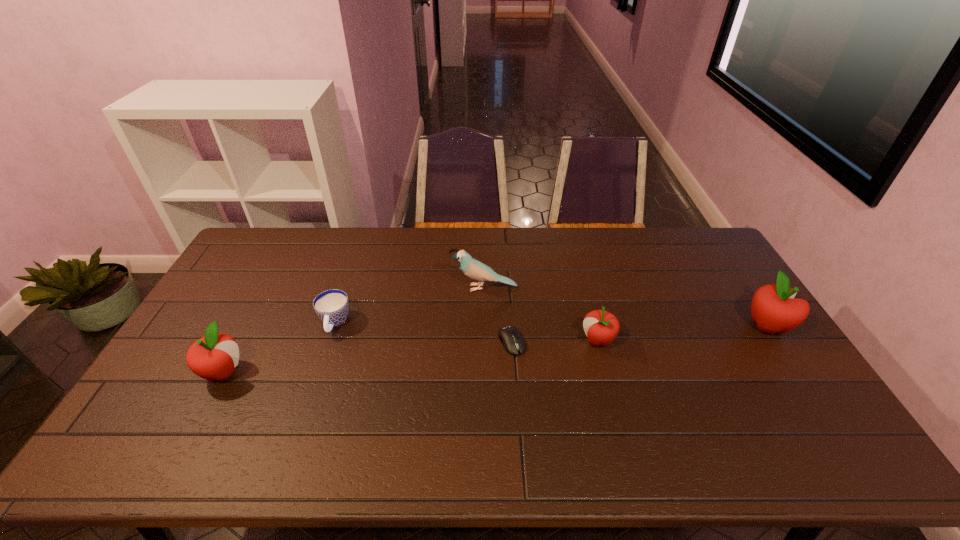
Find the location of `free space between the rightmost object and the bird`. free space between the rightmost object and the bird is located at coordinates (626, 307).

Find the location of a particular element. The height and width of the screenshot is (540, 960). vacant space that is in between the farthest object and the rightmost apple is located at coordinates (626, 307).

Locate an element on the screen. This screenshot has height=540, width=960. vacant space in between the second tallest apple and the shortest apple is located at coordinates (411, 356).

Locate an element on the screen. This screenshot has height=540, width=960. empty location between the nearest apple and the rightmost apple is located at coordinates (495, 349).

Find the location of `object that is the fourth closest to the fifth object from left to right`. object that is the fourth closest to the fifth object from left to right is located at coordinates (332, 306).

Identify which object is the third nearest to the leftmost object. Please provide its 2D coordinates. Your answer should be formatted as a tuple, i.e. [(x, y)], where the tuple contains the x and y coordinates of a point satisfying the conditions above.

[(510, 337)]

Choose which apple is the nearest neighbor to the bird. Please provide its 2D coordinates. Your answer should be formatted as a tuple, i.e. [(x, y)], where the tuple contains the x and y coordinates of a point satisfying the conditions above.

[(601, 327)]

Choose which apple is the nearest neighbor to the computer equipment. Please provide its 2D coordinates. Your answer should be formatted as a tuple, i.e. [(x, y)], where the tuple contains the x and y coordinates of a point satisfying the conditions above.

[(601, 327)]

Identify the location of free space that satisfies the following two spatial constraints: 1. on the side of the second shortest object with the handle; 2. on the right side of the shortest object. Image resolution: width=960 pixels, height=540 pixels. pos(328,342).

This screenshot has width=960, height=540. In order to click on vacant space that satisfies the following two spatial constraints: 1. at the face of the farthest object; 2. on the right side of the shortest apple in this screenshot , I will do `click(485, 341)`.